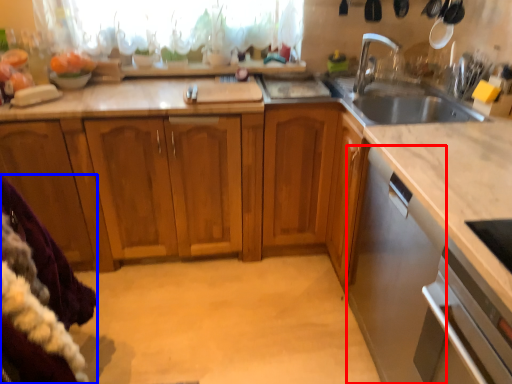
Question: Which object is closer to the camera taking this photo, dish washer (highlighted by a red box) or blanket (highlighted by a blue box)?

Choices:
 (A) dish washer
 (B) blanket

Answer: (B)